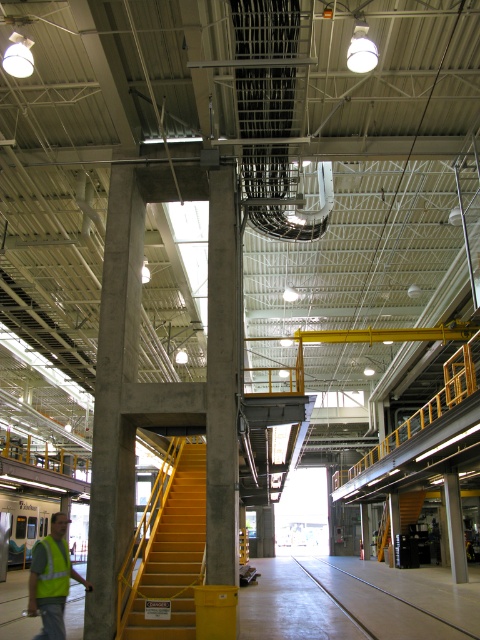
You are an inspector in this rail yard and need to ensure all safety equipment is properly placed. You see two safety vests at the lower left corner. Which one is positioned lower between the reflective yellow vest at lower left and the high visibility fabric safety vest at lower left?

The reflective yellow vest at lower left is positioned lower than the high visibility fabric safety vest at lower left.

You are standing at the point marked as point (173, 602) in a large industrial facility. You want to take a photo of the entire space. If your camera can capture a maximum distance of 10 meters, will you be able to capture the entire facility in one shot?

The distance between you at point (173, 602) and the camera is 11.41 meters, which exceeds the camera maximum 10 meters range. Therefore, you won not be able to capture the entire facility in one shot.